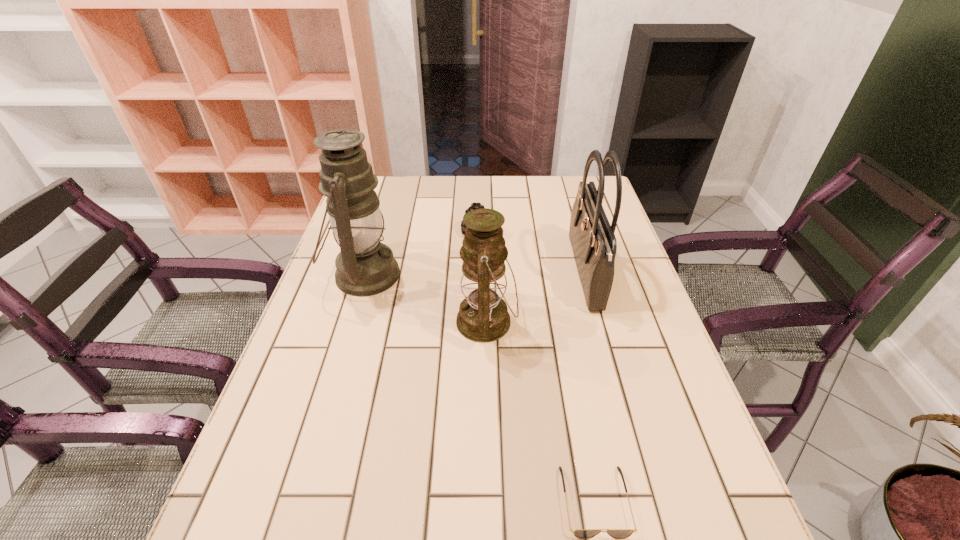
At what (x,y) coordinates should I click in order to perform the action: click on the left oil lamp. Please return your answer as a coordinate pair (x, y). This screenshot has height=540, width=960. Looking at the image, I should click on (365, 267).

Where is `the leftmost object`? The image size is (960, 540). the leftmost object is located at coordinates (365, 267).

Find the location of a particular element. This screenshot has width=960, height=540. handbag is located at coordinates (594, 245).

Where is `the shorter oil lamp`? The image size is (960, 540). the shorter oil lamp is located at coordinates (483, 316).

At what (x,y) coordinates should I click in order to perform the action: click on the fourth tallest object. Please return your answer as a coordinate pair (x, y). The width and height of the screenshot is (960, 540). Looking at the image, I should click on (474, 205).

This screenshot has height=540, width=960. Identify the location of sunglasses. (580, 533).

The image size is (960, 540). Identify the location of the shortest object. (580, 533).

Where is `free space located 0.130m on the front of the leftmost object`? free space located 0.130m on the front of the leftmost object is located at coordinates (342, 350).

The image size is (960, 540). I want to click on vacant space positioned 0.210m with an open clasp on the front of the rightmost object, so click(495, 274).

Find the location of a particular element. This screenshot has height=540, width=960. vacant area situated with an open clasp on the front of the rightmost object is located at coordinates (440, 274).